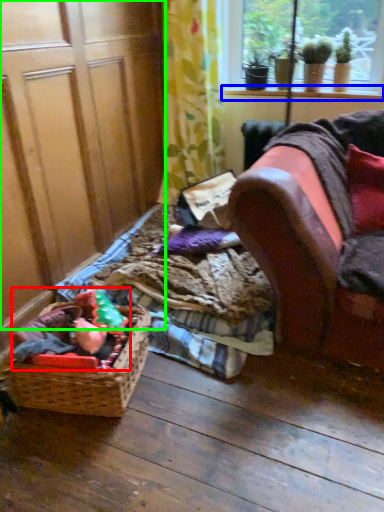
Question: Considering the real-world distances, which object is closest to stuff (highlighted by a red box)? window sill (highlighted by a blue box) or screen door (highlighted by a green box).

Choices:
 (A) window sill
 (B) screen door

Answer: (B)